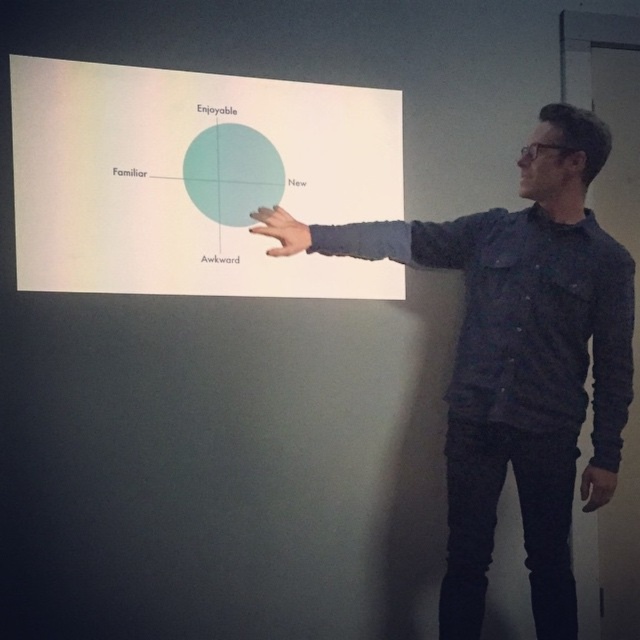
Does point (51, 166) come behind point (595, 502)?

No, (51, 166) is in front of (595, 502).

Between point (314, 186) and point (611, 492), which one is positioned in front?

Point (611, 492) is more forward.

Locate an element on the screen. This screenshot has width=640, height=640. white paper at center is located at coordinates (193, 179).

Who is taller, dark blue shirt at upper right or matte teal circle at center?

Standing taller between the two is dark blue shirt at upper right.

Describe the element at coordinates (522, 360) in the screenshot. The height and width of the screenshot is (640, 640). I see `dark blue shirt at upper right` at that location.

Identify the location of dark blue shirt at upper right. Image resolution: width=640 pixels, height=640 pixels. (522, 360).

Can you confirm if white paper at center is smaller than dark blue shirt at upper right?

Yes, white paper at center is smaller than dark blue shirt at upper right.

Describe the element at coordinates (193, 179) in the screenshot. This screenshot has height=640, width=640. I see `white paper at center` at that location.

The height and width of the screenshot is (640, 640). I want to click on white paper at center, so click(193, 179).